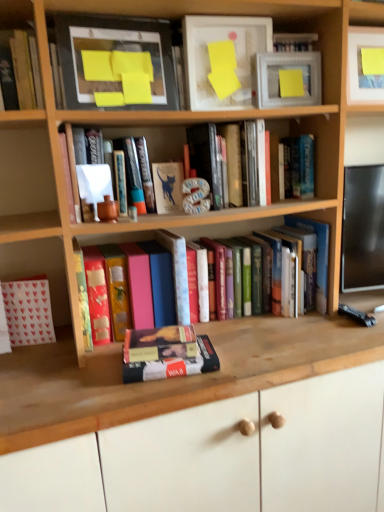
Identify the location of vacant space to the right of hardcover book at center, which is the 4th book in left-to-right order. (251, 358).